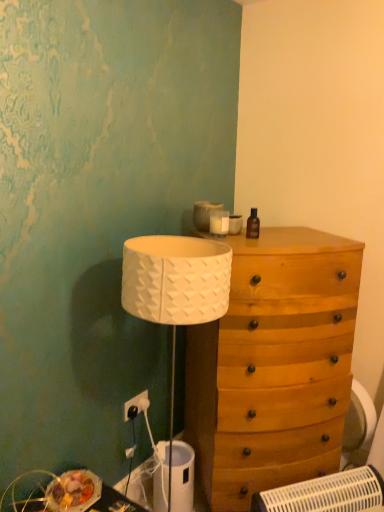
Question: Is white plastic electric outlet at lower left not within brown glass bottle at upper right?

Choices:
 (A) no
 (B) yes

Answer: (B)

Question: From a real-world perspective, is white plastic electric outlet at lower left under brown glass bottle at upper right?

Choices:
 (A) no
 (B) yes

Answer: (B)

Question: Is white plastic electric outlet at lower left not close to brown glass bottle at upper right?

Choices:
 (A) yes
 (B) no

Answer: (B)

Question: Does white plastic electric outlet at lower left have a lesser height compared to brown glass bottle at upper right?

Choices:
 (A) no
 (B) yes

Answer: (B)

Question: Can you confirm if white plastic electric outlet at lower left is smaller than brown glass bottle at upper right?

Choices:
 (A) yes
 (B) no

Answer: (B)

Question: Is point (251, 225) closer or farther from the camera than point (235, 510)?

Choices:
 (A) closer
 (B) farther

Answer: (A)

Question: In terms of size, does brown glass bottle at upper right appear bigger or smaller than wooden drawer at center?

Choices:
 (A) big
 (B) small

Answer: (B)

Question: Is brown glass bottle at upper right inside or outside of wooden drawer at center?

Choices:
 (A) inside
 (B) outside

Answer: (B)

Question: In terms of height, does brown glass bottle at upper right look taller or shorter compared to wooden drawer at center?

Choices:
 (A) tall
 (B) short

Answer: (B)

Question: Relative to brown glass bottle at upper right, is white plastic electric outlet at lower left in front or behind?

Choices:
 (A) behind
 (B) front

Answer: (A)

Question: Is white plastic electric outlet at lower left bigger or smaller than brown glass bottle at upper right?

Choices:
 (A) big
 (B) small

Answer: (A)

Question: In terms of height, does white plastic electric outlet at lower left look taller or shorter compared to brown glass bottle at upper right?

Choices:
 (A) short
 (B) tall

Answer: (A)

Question: From the image's perspective, is white plastic electric outlet at lower left positioned above or below brown glass bottle at upper right?

Choices:
 (A) above
 (B) below

Answer: (B)

Question: Based on their positions, is wooden drawer at center located to the left or right of brown glass bottle at upper right?

Choices:
 (A) left
 (B) right

Answer: (B)

Question: In the image, is wooden drawer at center positioned in front of or behind brown glass bottle at upper right?

Choices:
 (A) front
 (B) behind

Answer: (A)